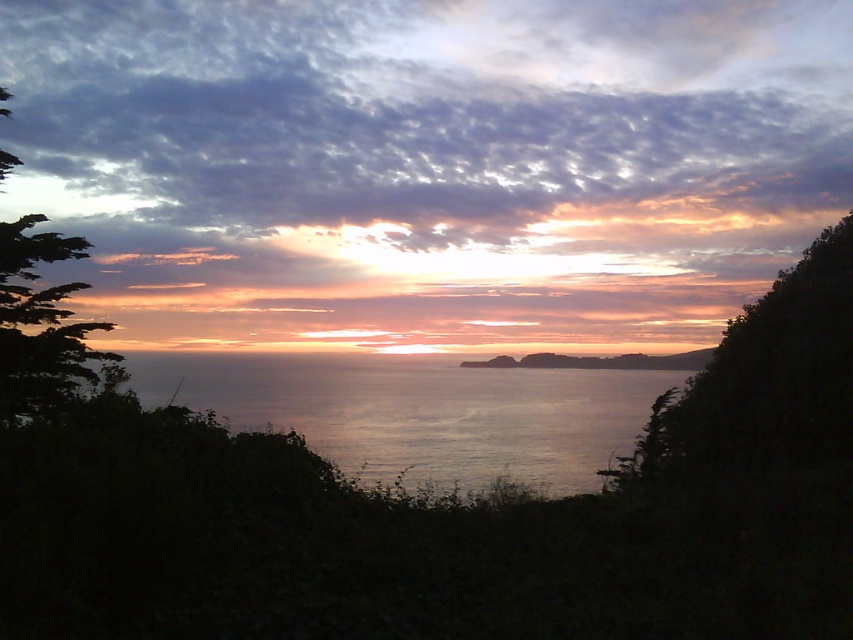
You are standing in the middle of the scene and want to take a photo of the cloudy sky at upper center and the green leafy tree at left. Which object will appear closer to the camera in the photo?

The cloudy sky at upper center will appear closer to the camera in the photo because it is further to the viewer than the green leafy tree at left, meaning it occupies a nearer spatial position in the visual plane.

You are an artist trying to paint the sunset scene. You want to ensure the cloudy sky at upper center and the green leafy tree at left are proportionally accurate. Which object should you draw first to maintain proper perspective?

The cloudy sky at upper center should be drawn first because it is much taller than the green leafy tree at left, so establishing its height first will help maintain proper perspective.